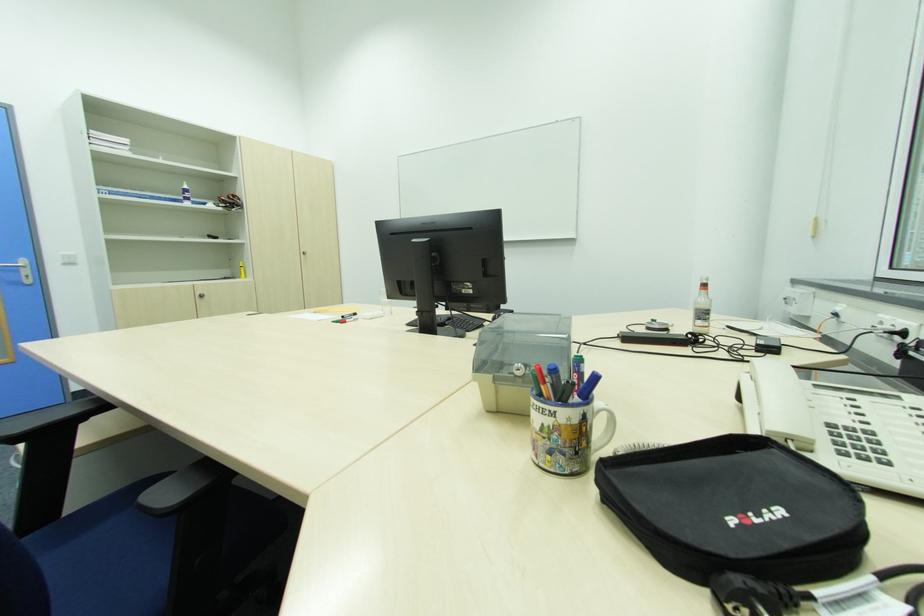
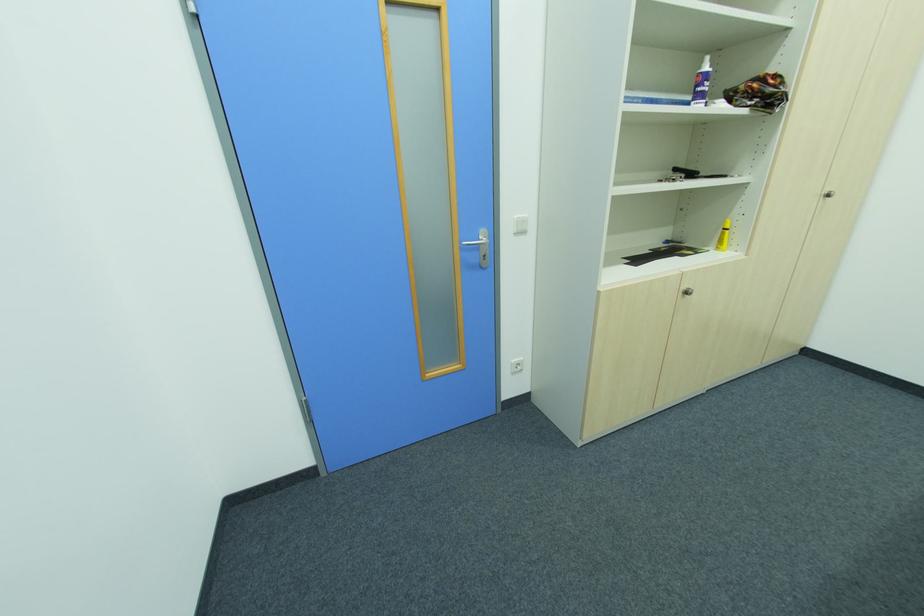
The point at (189, 192) is marked in the first image. Where is the corresponding point in the second image?

(708, 78)